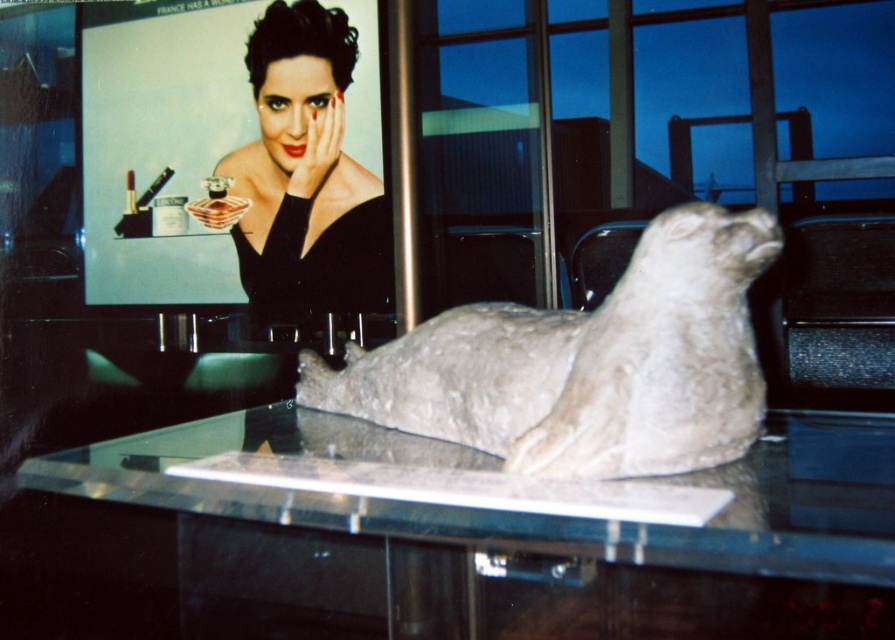
You are a delivery person placing a package on the clear glass table at center and the gray stone seal at center. Which object should you place the package on to ensure it is closer to the right side of the room?

You should place the package on the gray stone seal at center because the clear glass table at center is on the left side of it, meaning the gray stone seal at center is closer to the right side of the room.

You are a delivery person who needs to place a package between the gray stone seal at center and the matte black dress at upper center. The package requires 2 meters of space. Can you fit it there?

The distance between the gray stone seal at center and the matte black dress at upper center is 1.91 meters, which is less than the required 2 meters. Therefore, the package cannot be placed there.